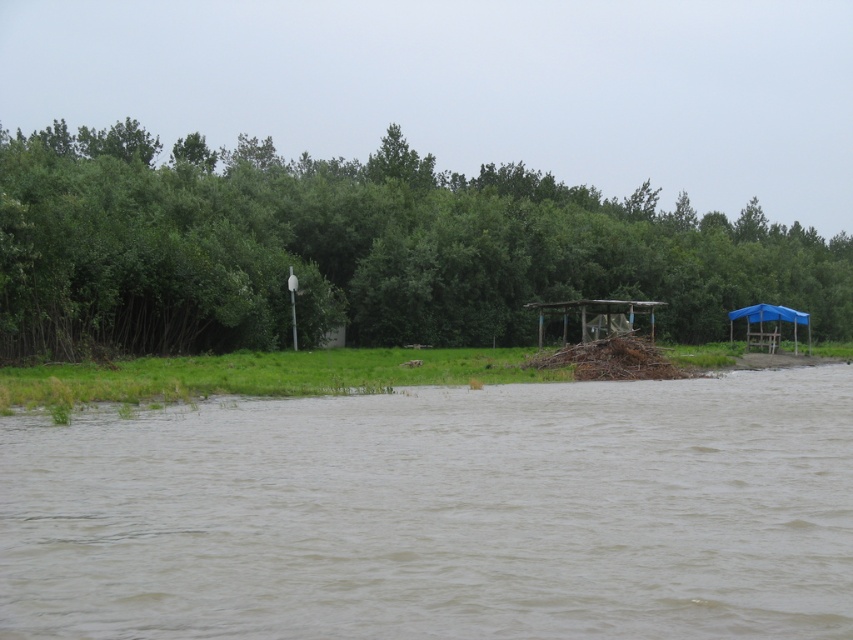
Is point (624, 316) positioned before point (763, 305)?

Yes, it is in front of point (763, 305).

Between wooden rustic shelter at center and blue fabric shelter at right, which one has more height?

blue fabric shelter at right is taller.

This screenshot has width=853, height=640. What do you see at coordinates (596, 316) in the screenshot?
I see `wooden rustic shelter at center` at bounding box center [596, 316].

At what (x,y) coordinates should I click in order to perform the action: click on wooden rustic shelter at center. Please return your answer as a coordinate pair (x, y). The image size is (853, 640). Looking at the image, I should click on tap(596, 316).

Identify the location of brown muddy water at lower center. (440, 513).

Who is more distant from viewer, (537, 464) or (773, 252)?

Point (773, 252)

In order to click on brown muddy water at lower center in this screenshot , I will do `click(440, 513)`.

Can you confirm if brown wood debris at center is thinner than wooden rustic shelter at center?

Yes.

Can you confirm if brown wood debris at center is positioned to the left of wooden rustic shelter at center?

Yes, brown wood debris at center is to the left of wooden rustic shelter at center.

Does point (660, 364) lie behind point (566, 314)?

No, it is in front of (566, 314).

The width and height of the screenshot is (853, 640). What are the coordinates of `brown wood debris at center` in the screenshot? It's located at (611, 360).